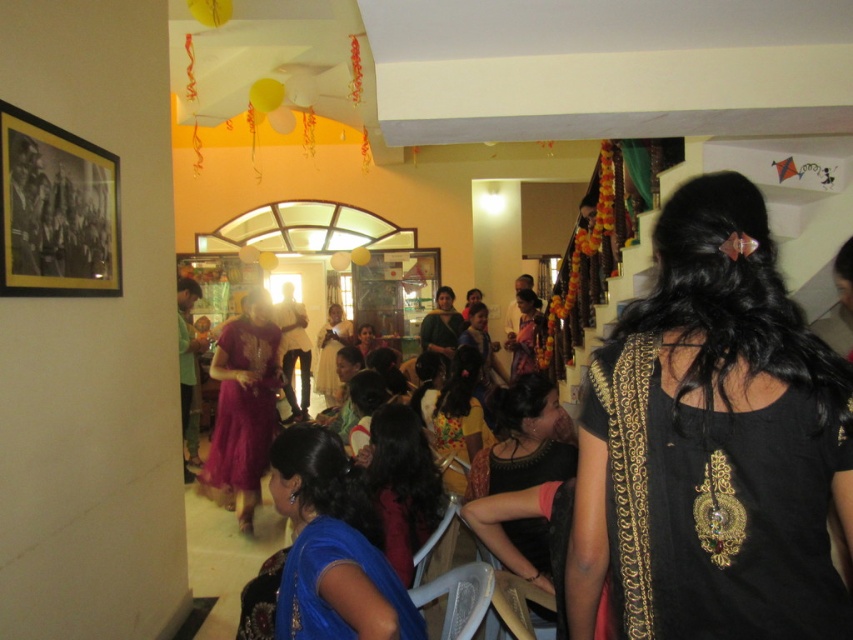
Which of these two, blue satin saree at center or matte pink saree at center, stands shorter?

blue satin saree at center is shorter.

Does blue satin saree at center appear on the left side of matte pink saree at center?

No, blue satin saree at center is not to the left of matte pink saree at center.

Measure the distance between blue satin saree at center and camera.

blue satin saree at center is 4.63 feet from camera.

Image resolution: width=853 pixels, height=640 pixels. What are the coordinates of `blue satin saree at center` in the screenshot? It's located at (325, 552).

In the scene shown: Between black satin blouse at center and matte black dress at center, which one has more height?

With more height is black satin blouse at center.

Who is positioned more to the right, black satin blouse at center or matte black dress at center?

black satin blouse at center is more to the right.

Between point (543, 442) and point (419, 529), which one is positioned in front?

Point (419, 529) is in front.

Find the location of a particular element. black satin blouse at center is located at coordinates (524, 440).

Can you confirm if black embroidered blouse at center is positioned above matte pink saree at center?

Correct, black embroidered blouse at center is located above matte pink saree at center.

Who is shorter, black embroidered blouse at center or matte pink saree at center?

Standing shorter between the two is black embroidered blouse at center.

Does point (737, 444) come farther from viewer compared to point (332, 332)?

No, (737, 444) is in front of (332, 332).

Locate an element on the screen. The width and height of the screenshot is (853, 640). black embroidered blouse at center is located at coordinates (712, 444).